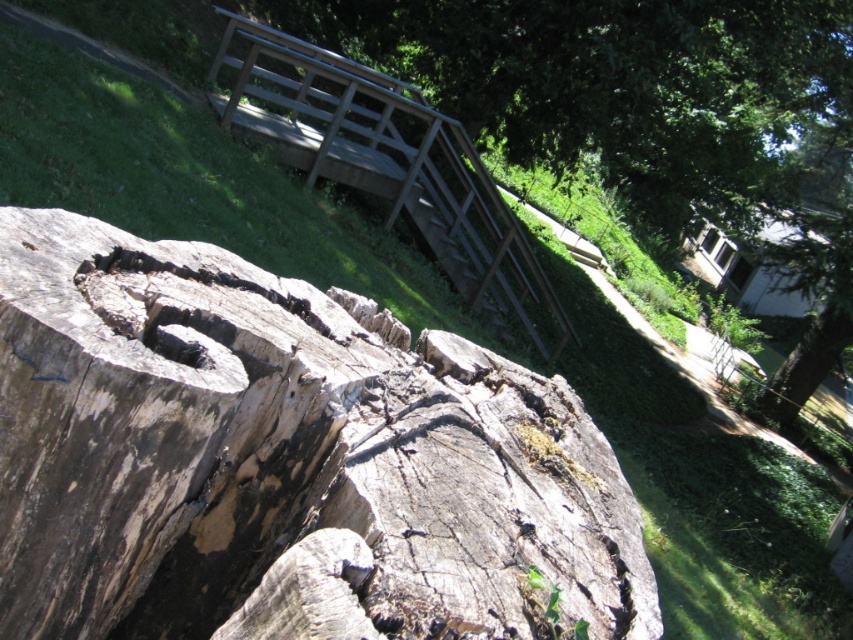
Which is more to the left, wooden rail at upper center or smooth brown tree trunk at upper right?

From the viewer's perspective, wooden rail at upper center appears more on the left side.

Who is positioned more to the right, wooden rail at upper center or smooth brown tree trunk at upper right?

smooth brown tree trunk at upper right

Locate an element on the screen. The width and height of the screenshot is (853, 640). wooden rail at upper center is located at coordinates (387, 161).